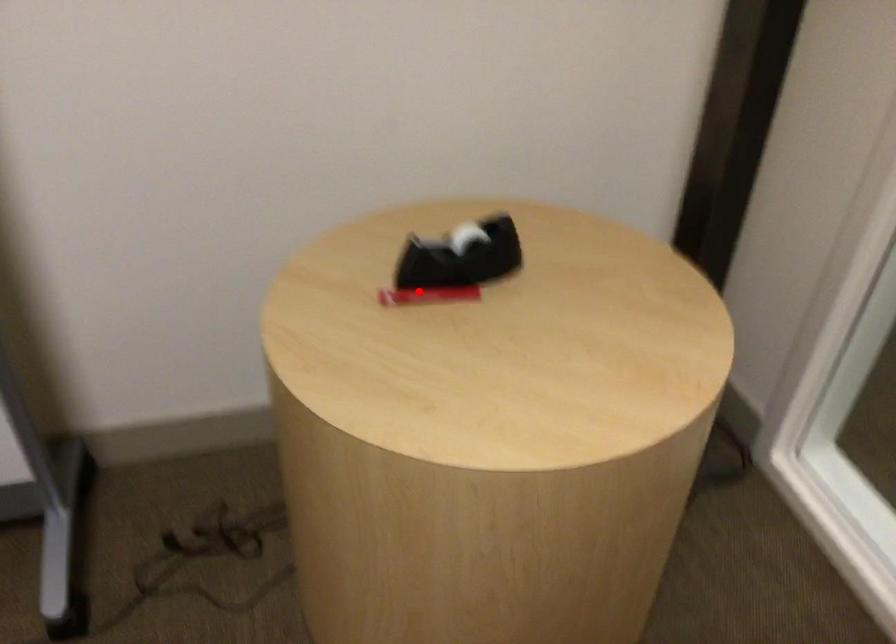
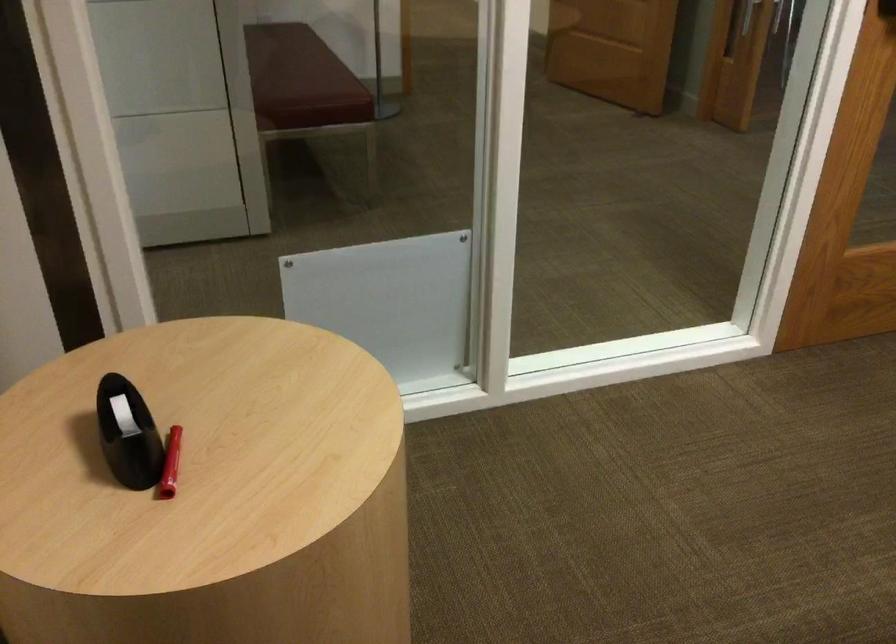
In the second image, find the point that corresponds to the highlighted location in the first image.

(170, 464)